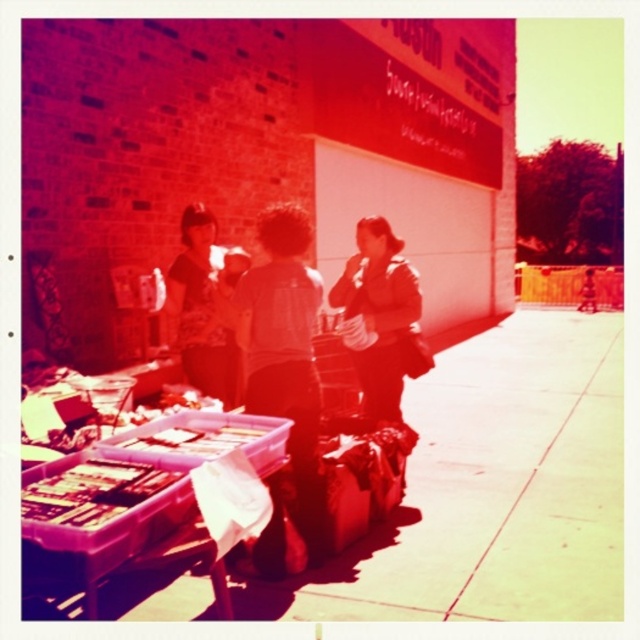
Question: Can you confirm if matte brown jacket at center is bigger than matte black shirt at center?

Choices:
 (A) no
 (B) yes

Answer: (B)

Question: Is matte brown jacket at center smaller than matte black shirt at center?

Choices:
 (A) no
 (B) yes

Answer: (A)

Question: Is matte brown jacket at center to the right of matte black shirt at center from the viewer's perspective?

Choices:
 (A) no
 (B) yes

Answer: (B)

Question: Among these points, which one is farthest from the camera?

Choices:
 (A) (396, 273)
 (B) (189, 305)

Answer: (B)

Question: Which point is closer to the camera?

Choices:
 (A) (392, 285)
 (B) (220, 394)

Answer: (A)